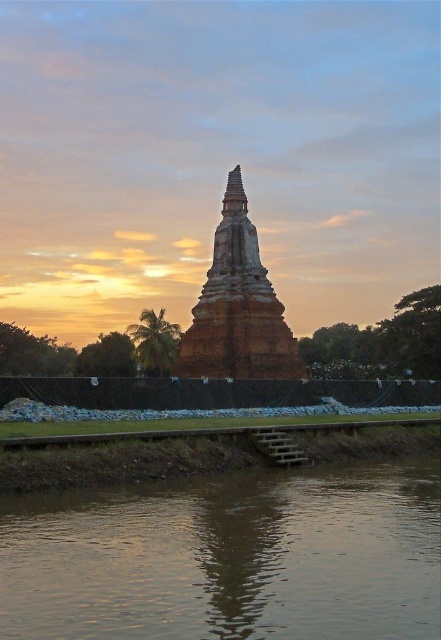
You are an architect analyzing the spatial relationship between the brown muddy water at lower center and the brown textured stone tower at center. Which object takes up more area in the image?

The brown textured stone tower at center occupies more space than the brown muddy water at lower center.

Based on the photo, you are a tour guide explaining the scene to visitors. You mention the brown muddy water at lower center and the brown textured stone tower at center. How far apart are these two landmarks?

The distance between the brown muddy water at lower center and the brown textured stone tower at center is 144.25 feet.

You are standing at the edge of the scene and want to cross to the pagoda. The brown muddy water at lower center is in your path. Based on its location, can you step over it easily?

The brown muddy water at lower center is located at point (230, 557), which means it is positioned near the lower part of the image. Since you are at the edge, you would need to navigate around it to reach the pagoda, so stepping over might not be possible easily.